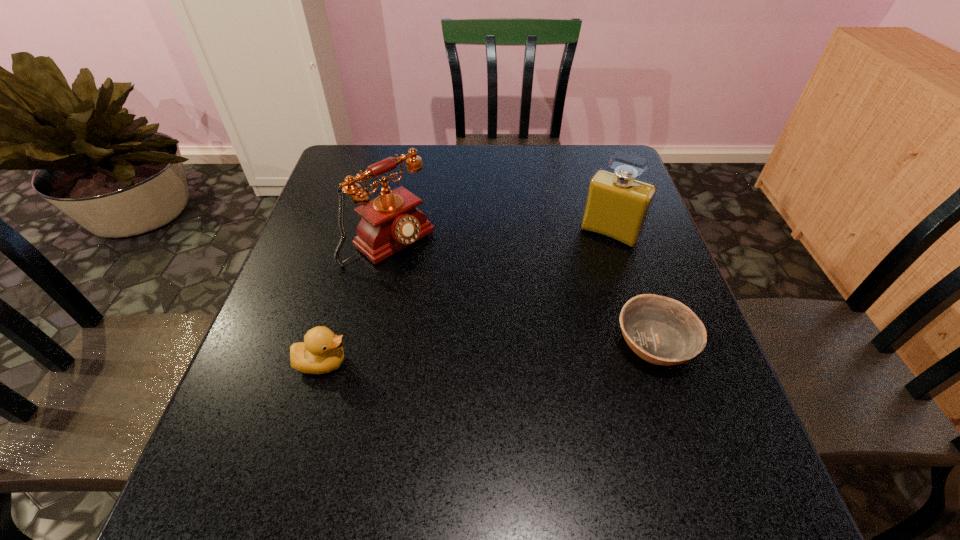
I want to click on blank area at the far left corner, so click(376, 161).

Locate an element on the screen. The height and width of the screenshot is (540, 960). vacant space at the far right corner of the desktop is located at coordinates (574, 150).

You are a GUI agent. You are given a task and a screenshot of the screen. Output one action in this format:
    pyautogui.click(x=<x>, y=<y>)
    Task: Click on the vacant space at the near right corner
    The width and height of the screenshot is (960, 540).
    Given the screenshot: What is the action you would take?
    pyautogui.click(x=667, y=407)

Image resolution: width=960 pixels, height=540 pixels. Find the location of `free space between the shortest object and the telephone`. free space between the shortest object and the telephone is located at coordinates (522, 292).

Find the location of a particular element. free point between the telephone and the perfume is located at coordinates (499, 238).

Where is `free space between the bowl and the duckling`? free space between the bowl and the duckling is located at coordinates (489, 352).

Locate an element on the screen. The height and width of the screenshot is (540, 960). empty location between the duckling and the perfume is located at coordinates (467, 298).

This screenshot has width=960, height=540. I want to click on vacant area that lies between the shortest object and the telephone, so click(522, 292).

Locate an element on the screen. The height and width of the screenshot is (540, 960). empty space between the bowl and the telephone is located at coordinates pyautogui.click(x=522, y=292).

What are the coordinates of `unoccupied position between the duckling and the telephone` in the screenshot? It's located at (356, 302).